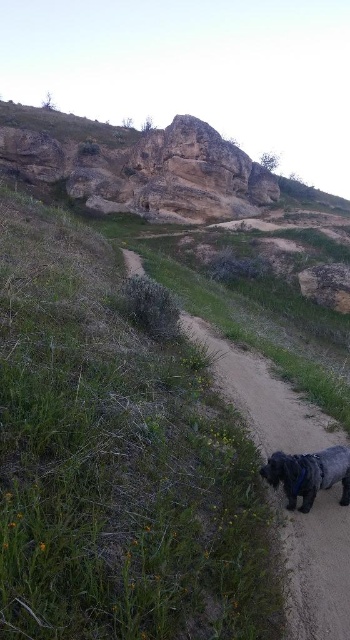
Question: Among these points, which one is farthest from the camera?

Choices:
 (A) (127, 273)
 (B) (329, 481)
 (C) (36, 172)

Answer: (C)

Question: Which object is closer to the camera taking this photo?

Choices:
 (A) shiny black dog at lower right
 (B) rugged stone cliff at upper center
 (C) dirt path at center

Answer: (C)

Question: Can you confirm if dirt path at center is positioned above shiny black dog at lower right?

Choices:
 (A) yes
 (B) no

Answer: (A)

Question: Is dirt path at center smaller than shiny black dog at lower right?

Choices:
 (A) yes
 (B) no

Answer: (B)

Question: Is rugged stone cliff at upper center positioned before shiny black dog at lower right?

Choices:
 (A) yes
 (B) no

Answer: (B)

Question: Which point is closer to the camera?

Choices:
 (A) (294, 477)
 (B) (268, 449)

Answer: (A)